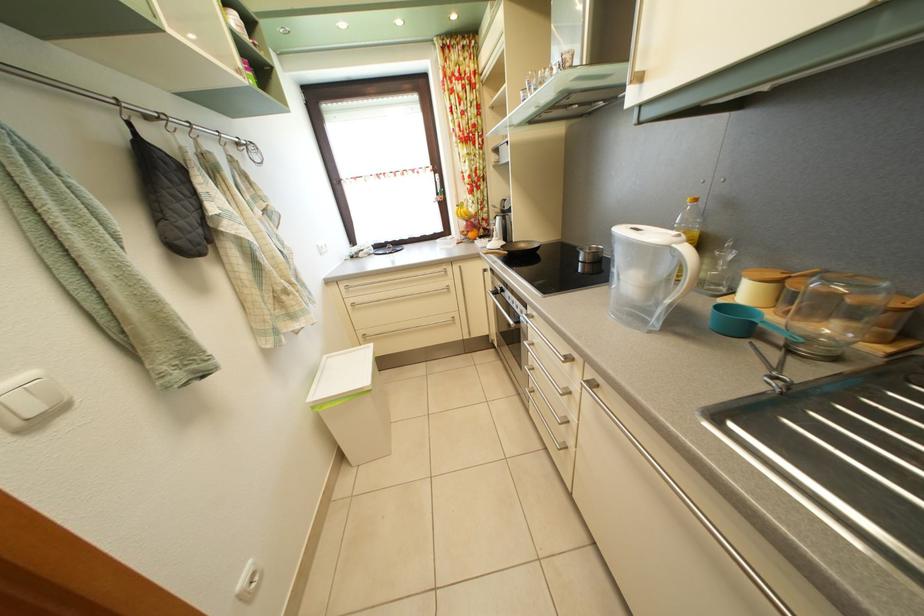
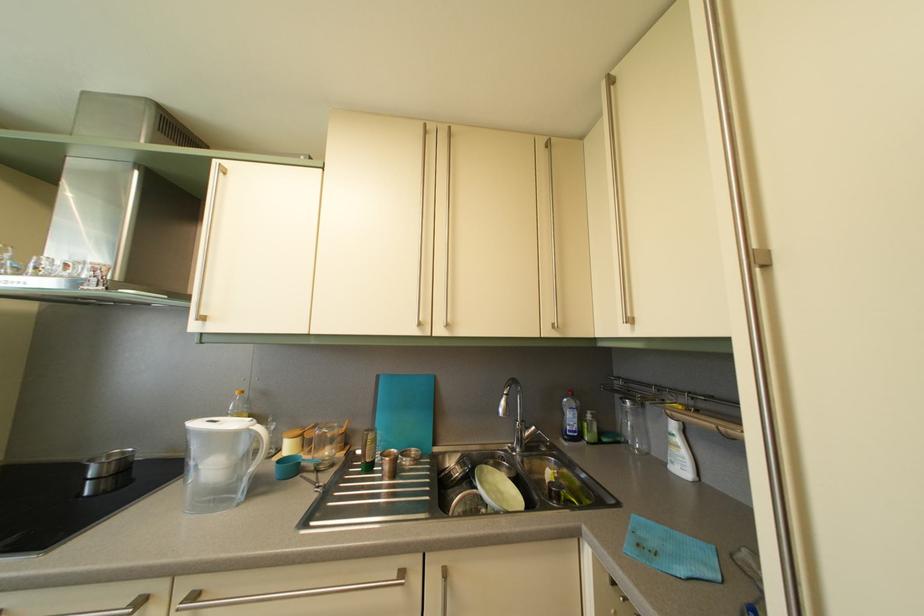
Where in the second image is the point corresponding to (x=837, y=289) from the first image?

(330, 436)